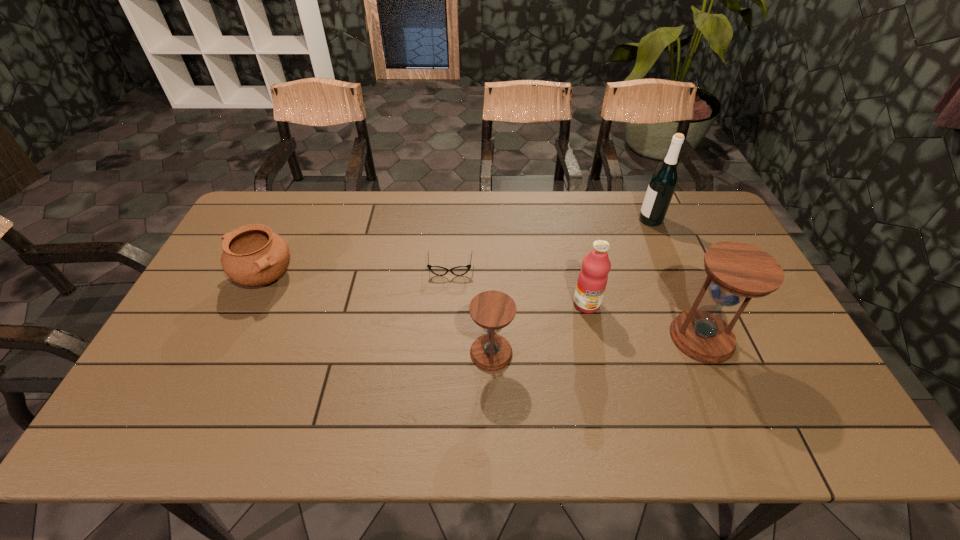
Locate an element on the screen. The image size is (960, 540). free location that satisfies the following two spatial constraints: 1. on the label of the wine bottle; 2. on the front side of the left hourglass is located at coordinates (708, 353).

Locate an element on the screen. The height and width of the screenshot is (540, 960). free point that satisfies the following two spatial constraints: 1. on the label of the tallest object; 2. on the left side of the second tallest object is located at coordinates (701, 338).

At what (x,y) coordinates should I click in order to perform the action: click on free location that satisfies the following two spatial constraints: 1. on the label of the tallest object; 2. on the front-facing side of the shortest object. Please return your answer as a coordinate pair (x, y). Looking at the image, I should click on (672, 269).

I want to click on free space that satisfies the following two spatial constraints: 1. on the label of the wine bottle; 2. on the label of the fruit juice, so click(686, 304).